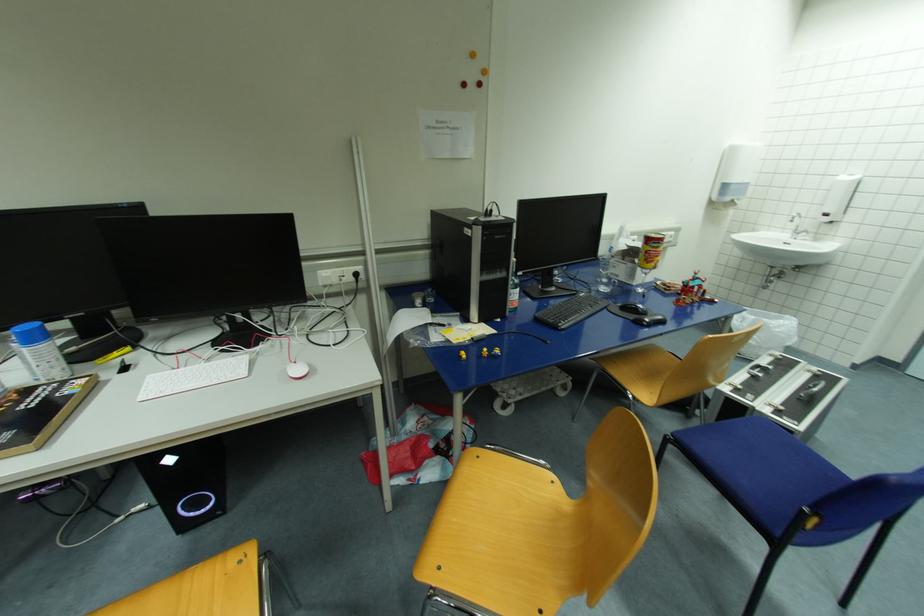
Where would you slid the black computer mouse? Please return your answer as a coordinate pair (x, y).

(650, 320)